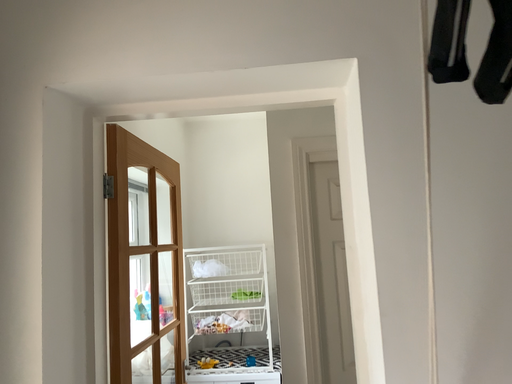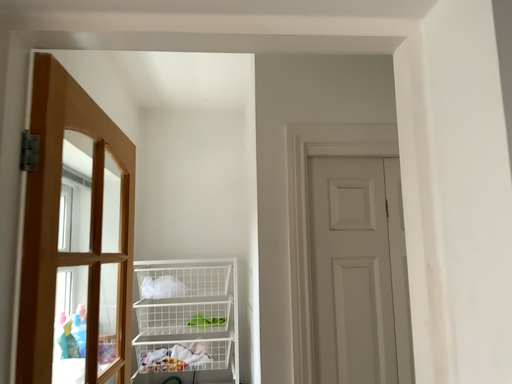
Question: Which way did the camera rotate in the video?

Choices:
 (A) rotated right
 (B) rotated left

Answer: (A)